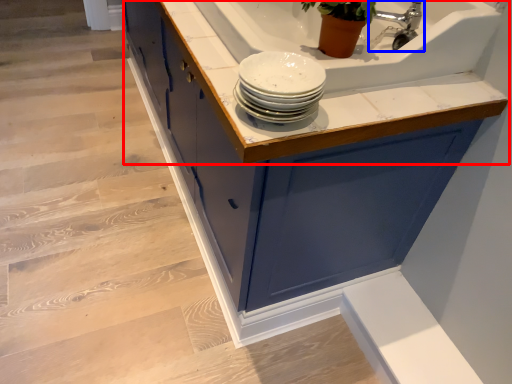
Question: Among these objects, which one is farthest to the camera, countertop (highlighted by a red box) or tap (highlighted by a blue box)?

Choices:
 (A) countertop
 (B) tap

Answer: (B)